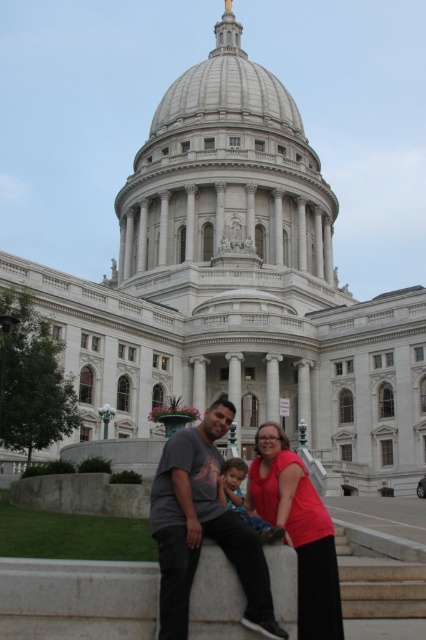
The height and width of the screenshot is (640, 426). I want to click on matte gray t-shirt at center, so click(203, 525).

Which is below, matte gray t-shirt at center or matte gray shirt at center?

matte gray t-shirt at center is below.

The width and height of the screenshot is (426, 640). I want to click on matte gray t-shirt at center, so click(203, 525).

Where is `matte gray t-shirt at center`? matte gray t-shirt at center is located at coordinates (203, 525).